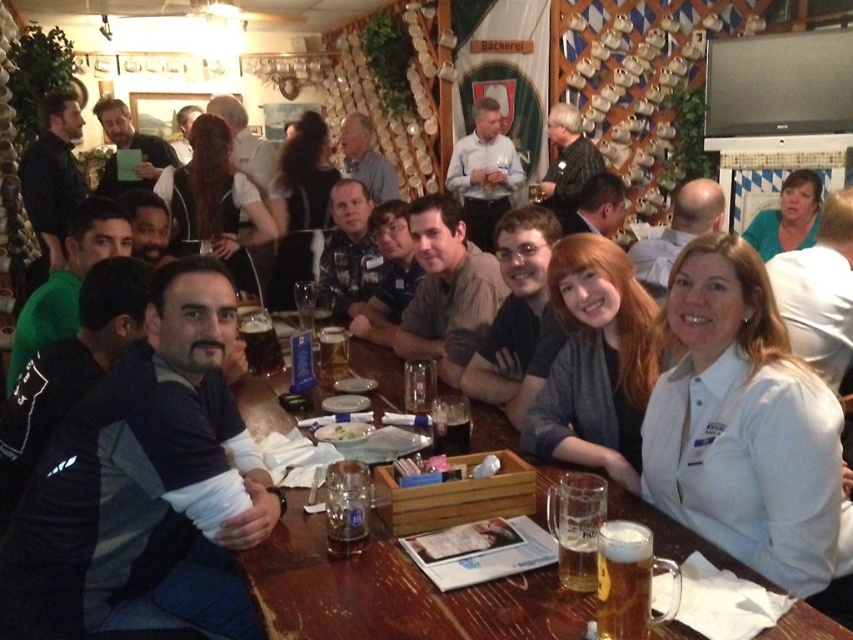
Who is lower down, green matte shirt at upper right or dark matte glass at center?

Positioned lower is dark matte glass at center.

The image size is (853, 640). I want to click on green matte shirt at upper right, so click(787, 216).

Find the location of `green matte shirt at upper right`. green matte shirt at upper right is located at coordinates (787, 216).

Does dark gray sweater at center have a smaller size compared to translucent glass mug at lower center?

No.

Between dark gray sweater at center and translucent glass mug at lower center, which one has less height?

With less height is translucent glass mug at lower center.

Which is in front, point (148, 387) or point (585, 548)?

Point (585, 548)

Locate an element on the screen. This screenshot has width=853, height=640. dark gray sweater at center is located at coordinates (144, 486).

Which is in front, point (635, 416) or point (54, 157)?

Point (635, 416) is more forward.

Who is more distant from viewer, [549,435] or [44,184]?

Point [44,184]

The height and width of the screenshot is (640, 853). What do you see at coordinates (595, 362) in the screenshot?
I see `matte gray sweater at center` at bounding box center [595, 362].

At what (x,y) coordinates should I click in order to perform the action: click on matte gray sweater at center. Please return your answer as a coordinate pair (x, y). Looking at the image, I should click on (595, 362).